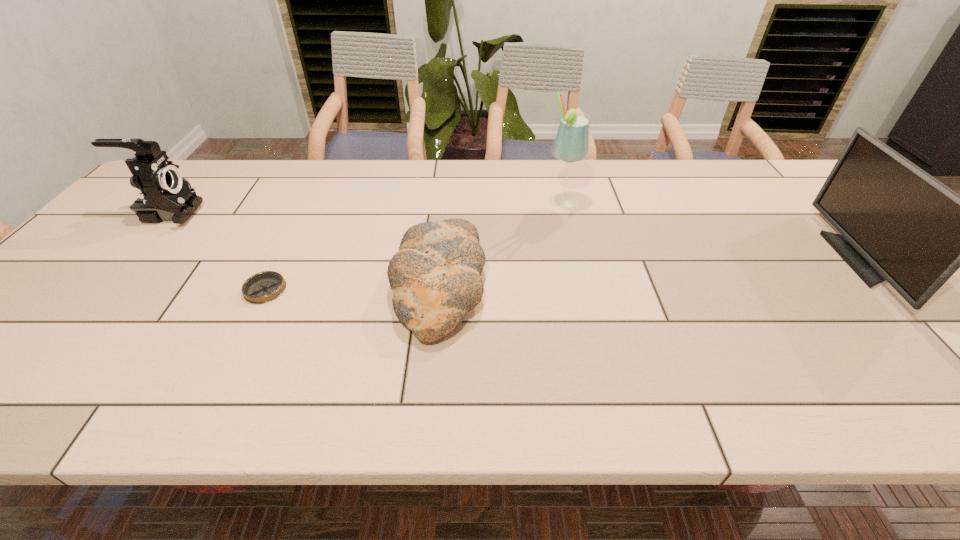
Where is `vacant space situated 0.210m on the screen side of the rightmost object`? The height and width of the screenshot is (540, 960). vacant space situated 0.210m on the screen side of the rightmost object is located at coordinates (762, 259).

This screenshot has width=960, height=540. Find the location of `vacant area situated 0.220m on the screen side of the rightmost object`. vacant area situated 0.220m on the screen side of the rightmost object is located at coordinates [x=758, y=259].

This screenshot has width=960, height=540. In order to click on free space located 0.210m on the screen side of the rightmost object in this screenshot , I will do `click(762, 259)`.

I want to click on free location located on the lens mount of the third shortest object, so click(x=272, y=213).

I want to click on free location located on the back of the bread, so click(445, 216).

At what (x,y) coordinates should I click in order to perform the action: click on vacant space located on the left of the compass. Please return your answer as a coordinate pair (x, y). The image size is (960, 540). Looking at the image, I should click on (x=87, y=289).

At what (x,y) coordinates should I click in order to perform the action: click on alcohol present at the far edge. Please return your answer as a coordinate pair (x, y). Looking at the image, I should click on [572, 141].

You are a GUI agent. You are given a task and a screenshot of the screen. Output one action in this format:
    pyautogui.click(x=<x>, y=<y>)
    Task: Click on the camcorder located in the far edge section of the desktop
    
    Given the screenshot: What is the action you would take?
    pyautogui.click(x=164, y=195)

Where is `object that is at the left edge`? Image resolution: width=960 pixels, height=540 pixels. object that is at the left edge is located at coordinates (164, 195).

Locate an element on the screen. This screenshot has width=960, height=540. object that is positioned at the right edge is located at coordinates (898, 223).